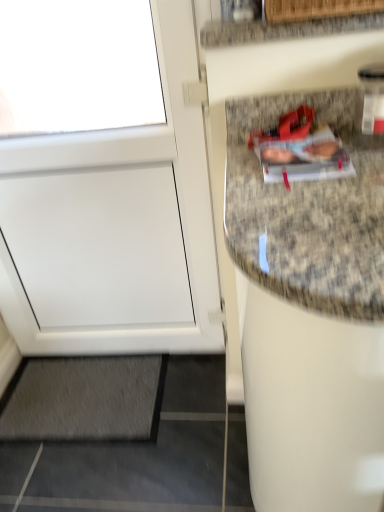
The height and width of the screenshot is (512, 384). What do you see at coordinates (104, 181) in the screenshot?
I see `white matte door at left` at bounding box center [104, 181].

What do you see at coordinates (283, 29) in the screenshot? I see `granite countertop at upper right` at bounding box center [283, 29].

Locate an element on the screen. The image size is (384, 512). white matte door at left is located at coordinates (104, 181).

Is white matte door at left to the right of gray carpet at lower left from the viewer's perspective?

Yes, white matte door at left is to the right of gray carpet at lower left.

Is white matte door at left wider or thinner than gray carpet at lower left?

white matte door at left is thinner than gray carpet at lower left.

Looking at this image, from the image's perspective, which is above, white matte door at left or gray carpet at lower left?

white matte door at left is shown above in the image.

From a real-world perspective, is white matte door at left physically below gray carpet at lower left?

No.

Does point (147, 372) appear closer or farther from the camera than point (158, 239)?

Point (147, 372).

Is gray carpet at lower left positioned before white matte door at left?

No, it is behind white matte door at left.

How much distance is there between gray carpet at lower left and white matte door at left?

They are 17.18 inches apart.

Looking at this image, is gray carpet at lower left positioned beyond the bounds of white matte door at left?

That's correct, gray carpet at lower left is outside of white matte door at left.

Identify the location of door that is behind the granite countertop at upper right. (104, 181).

Can you confirm if white matte door at left is wider than granite countertop at upper right?

In fact, white matte door at left might be narrower than granite countertop at upper right.

Between white matte door at left and granite countertop at upper right, which one appears on the right side from the viewer's perspective?

granite countertop at upper right is more to the right.

Can you confirm if white matte door at left is smaller than granite countertop at upper right?

No.

Is point (40, 429) closer or farther from the camera than point (252, 33)?

Point (40, 429) is farther from the camera than point (252, 33).

Is gray carpet at lower left positioned with its back to granite countertop at upper right?

No, gray carpet at lower left's orientation is not away from granite countertop at upper right.

Is gray carpet at lower left smaller than granite countertop at upper right?

Actually, gray carpet at lower left might be larger than granite countertop at upper right.

Between gray carpet at lower left and granite countertop at upper right, which one has less height?

gray carpet at lower left is shorter.

Considering the relative sizes of granite countertop at upper right and white matte door at left in the image provided, is granite countertop at upper right wider than white matte door at left?

Yes, granite countertop at upper right is wider than white matte door at left.

Identify the location of door below the granite countertop at upper right (from the image's perspective). (104, 181).

Would you say granite countertop at upper right is a long distance from white matte door at left?

No, granite countertop at upper right is in close proximity to white matte door at left.

Does granite countertop at upper right have a smaller size compared to white matte door at left?

Correct, granite countertop at upper right occupies less space than white matte door at left.

Can you confirm if granite countertop at upper right is bigger than gray carpet at lower left?

No.

From the image's perspective, which object appears higher, granite countertop at upper right or gray carpet at lower left?

granite countertop at upper right, from the image's perspective.

Is granite countertop at upper right further to camera compared to gray carpet at lower left?

No.

Is granite countertop at upper right thinner than gray carpet at lower left?

Yes, granite countertop at upper right is thinner than gray carpet at lower left.

Where is `door above the gray carpet at lower left (from the image's perspective)`? This screenshot has width=384, height=512. door above the gray carpet at lower left (from the image's perspective) is located at coordinates (104, 181).

At what (x,y) coordinates should I click in order to perform the action: click on door above the gray carpet at lower left (from a real-world perspective). Please return your answer as a coordinate pair (x, y). The height and width of the screenshot is (512, 384). Looking at the image, I should click on point(104,181).

Considering their positions, is white matte door at left positioned closer to granite countertop at upper right than gray carpet at lower left?

The object closer to granite countertop at upper right is white matte door at left.

When comparing their distances from granite countertop at upper right, does gray carpet at lower left or white matte door at left seem further?

gray carpet at lower left.

Based on their spatial positions, is granite countertop at upper right or white matte door at left closer to gray carpet at lower left?

white matte door at left is positioned closer to the anchor gray carpet at lower left.

Looking at the image, which one is located closer to white matte door at left, granite countertop at upper right or gray carpet at lower left?

Among the two, gray carpet at lower left is located nearer to white matte door at left.

Estimate the real-world distances between objects in this image. Which object is closer to white matte door at left, gray carpet at lower left or granite countertop at upper right?

gray carpet at lower left.

Which object lies nearer to the anchor point gray carpet at lower left, white matte door at left or granite countertop at upper right?

white matte door at left is positioned closer to the anchor gray carpet at lower left.

This screenshot has height=512, width=384. I want to click on door that lies between granite countertop at upper right and gray carpet at lower left from top to bottom, so click(104, 181).